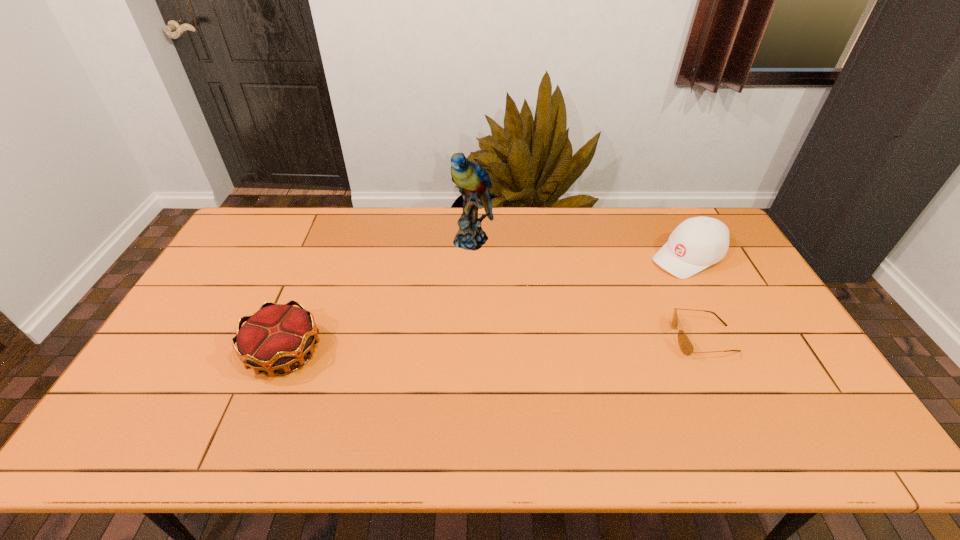
Identify the location of vacant space on the desktop that is between the third tallest object and the sunglasses and is positioned on the face of the parrot. This screenshot has width=960, height=540. (438, 347).

The width and height of the screenshot is (960, 540). What are the coordinates of `vacant space on the desktop that is between the crown and the shortest object and is positioned on the front-facing side of the second tallest object` in the screenshot? It's located at coord(524,345).